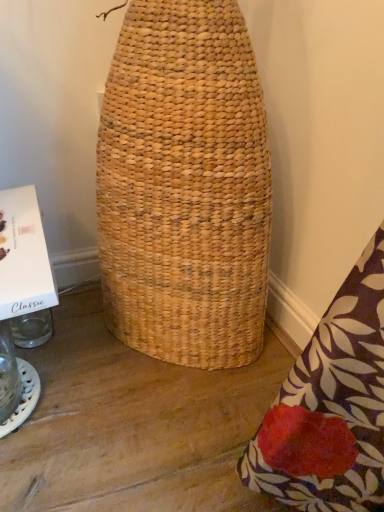
Identify the location of transparent glass jar at lower left. (8, 375).

Describe the element at coordinates (8, 375) in the screenshot. I see `transparent glass jar at lower left` at that location.

The height and width of the screenshot is (512, 384). I want to click on white cardboard box at left, so click(24, 256).

Describe the element at coordinates (24, 256) in the screenshot. I see `white cardboard box at left` at that location.

Identify the location of transparent glass jar at lower left. The height and width of the screenshot is (512, 384). (8, 375).

Does transparent glass jar at lower left appear on the right side of white cardboard box at left?

No, transparent glass jar at lower left is not to the right of white cardboard box at left.

Relative to white cardboard box at left, is transparent glass jar at lower left in front or behind?

transparent glass jar at lower left is behind white cardboard box at left.

Which is behind, point (8, 359) or point (31, 254)?

Positioned behind is point (8, 359).

From the image's perspective, is transparent glass jar at lower left located above or below white cardboard box at left?

From the image's perspective, transparent glass jar at lower left appears below white cardboard box at left.

From a real-world perspective, is transparent glass jar at lower left over white cardboard box at left?

No, from a real-world perspective, transparent glass jar at lower left is not over white cardboard box at left

Which object is wider, transparent glass jar at lower left or white cardboard box at left?

With larger width is white cardboard box at left.

From their relative heights in the image, would you say transparent glass jar at lower left is taller or shorter than white cardboard box at left?

transparent glass jar at lower left is taller than white cardboard box at left.

Is transparent glass jar at lower left bigger than white cardboard box at left?

Yes, transparent glass jar at lower left is bigger than white cardboard box at left.

Is white cardboard box at left located within transparent glass jar at lower left?

No, white cardboard box at left is not surrounded by transparent glass jar at lower left.

Is transparent glass jar at lower left next to white cardboard box at left?

No, transparent glass jar at lower left is not next to white cardboard box at left.

Is transparent glass jar at lower left turned away from white cardboard box at left?

No, transparent glass jar at lower left's orientation is not away from white cardboard box at left.

You are a GUI agent. You are given a task and a screenshot of the screen. Output one action in this format:
    pyautogui.click(x=<x>, y=<y>)
    Task: Click on the cardboard box in front of the transparent glass jar at lower left
    Image resolution: width=384 pixels, height=512 pixels.
    Given the screenshot: What is the action you would take?
    pyautogui.click(x=24, y=256)

Considering the positions of objects white cardboard box at left and transparent glass jar at lower left in the image provided, who is more to the left, white cardboard box at left or transparent glass jar at lower left?

Positioned to the left is transparent glass jar at lower left.

Does white cardboard box at left lie behind transparent glass jar at lower left?

No, white cardboard box at left is closer to the viewer.

Considering the points (1, 234) and (11, 360), which point is in front, point (1, 234) or point (11, 360)?

The point (1, 234) is closer.

From the image's perspective, is white cardboard box at left above or below transparent glass jar at lower left?

white cardboard box at left is situated higher than transparent glass jar at lower left in the image.

From a real-world perspective, does white cardboard box at left sit lower than transparent glass jar at lower left?

No.

Does white cardboard box at left have a greater width compared to transparent glass jar at lower left?

Indeed, white cardboard box at left has a greater width compared to transparent glass jar at lower left.

Which of these two, white cardboard box at left or transparent glass jar at lower left, stands shorter?

white cardboard box at left.

Considering the relative sizes of white cardboard box at left and transparent glass jar at lower left in the image provided, is white cardboard box at left bigger than transparent glass jar at lower left?

No, white cardboard box at left is not bigger than transparent glass jar at lower left.

Is white cardboard box at left completely or partially outside of transparent glass jar at lower left?

Absolutely, white cardboard box at left is external to transparent glass jar at lower left.

Is white cardboard box at left far away from transparent glass jar at lower left?

They are positioned close to each other.

Could you tell me if white cardboard box at left is turned towards transparent glass jar at lower left?

No, white cardboard box at left is not aimed at transparent glass jar at lower left.

What's the angular difference between white cardboard box at left and transparent glass jar at lower left's facing directions?

white cardboard box at left and transparent glass jar at lower left are facing 0.228 degrees away from each other.

How far apart are white cardboard box at left and transparent glass jar at lower left?

12.69 inches.

Locate an element on the screen. cardboard box lying on the right of transparent glass jar at lower left is located at coordinates (24, 256).

The width and height of the screenshot is (384, 512). In order to click on cardboard box located in front of the transparent glass jar at lower left in this screenshot , I will do coord(24,256).

At what (x,y) coordinates should I click in order to perform the action: click on cardboard box located above the transparent glass jar at lower left (from the image's perspective). Please return your answer as a coordinate pair (x, y). The height and width of the screenshot is (512, 384). Looking at the image, I should click on click(24, 256).